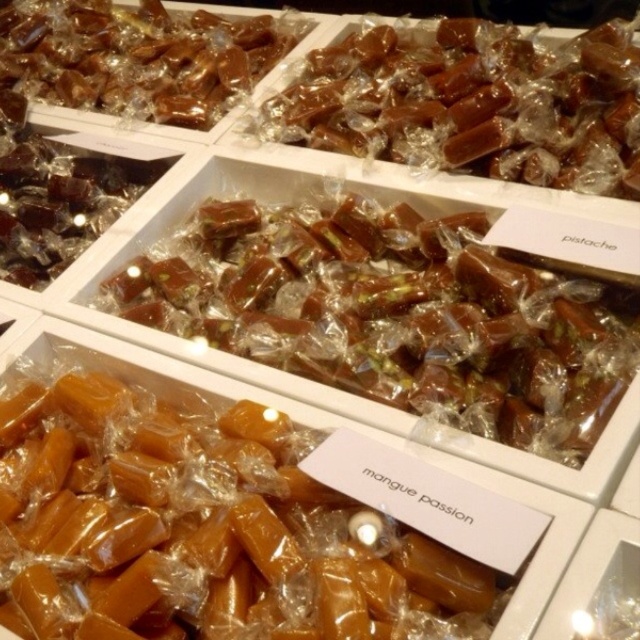
You are standing in front of the candy display. There are two points marked on the display. The first point is at coordinate point (452, 161) and the second point is at coordinate point (4, 60). Which point is closer to you?

Point (452, 161) is in front of point (4, 60), so the first point is closer to you.

You are at a candy store and see two types of candies displayed in trays. You notice the translucent caramel at center and the matte brown caramel at upper left. Which candy is positioned to the right of the other?

The translucent caramel at center is positioned to the right of the matte brown caramel at upper left.